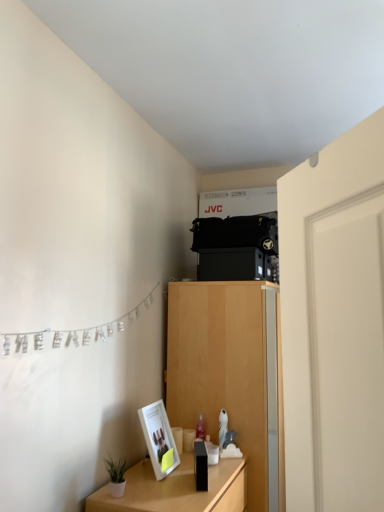
Locate an element on the screen. This screenshot has height=512, width=384. wooden table at lower left is located at coordinates (176, 489).

Where is `white smooth door at right`? white smooth door at right is located at coordinates (334, 323).

Would you say wooden table at lower left is inside or outside light wood cabinet at center?

wooden table at lower left is not inside light wood cabinet at center, it's outside.

Considering the relative sizes of wooden table at lower left and light wood cabinet at center in the image provided, is wooden table at lower left smaller than light wood cabinet at center?

Yes, wooden table at lower left is smaller than light wood cabinet at center.

Where is `cabinetry located on the right of wooden table at lower left`? cabinetry located on the right of wooden table at lower left is located at coordinates 231,373.

Is wooden table at lower left turned away from white smooth door at right?

No, wooden table at lower left is not facing the opposite direction of white smooth door at right.

Which object is closer to the camera, wooden table at lower left or white smooth door at right?

Positioned in front is white smooth door at right.

From the picture: Between wooden table at lower left and white smooth door at right, which one has larger size?

wooden table at lower left is bigger.

Is wooden table at lower left completely or partially outside of white smooth door at right?

Yes.

Is silver metallic banner at left not inside light wood cabinet at center?

Absolutely, silver metallic banner at left is external to light wood cabinet at center.

Which is closer to the camera, (90, 333) or (274, 464)?

Clearly, point (90, 333) is closer to the camera than point (274, 464).

The height and width of the screenshot is (512, 384). I want to click on cabinetry located on the right of silver metallic banner at left, so click(x=231, y=373).

Between light wood cabinet at center and matte white picture frame at lower left, which one is positioned behind?

light wood cabinet at center.

Is light wood cabinet at center facing towards matte white picture frame at lower left?

No, light wood cabinet at center is not turned towards matte white picture frame at lower left.

Considering the sizes of light wood cabinet at center and matte white picture frame at lower left in the image, is light wood cabinet at center bigger or smaller than matte white picture frame at lower left?

In the image, light wood cabinet at center appears to be larger than matte white picture frame at lower left.

Would you consider light wood cabinet at center to be distant from matte white picture frame at lower left?

They are positioned close to each other.

Does light wood cabinet at center turn towards wooden table at lower left?

No, light wood cabinet at center is not facing towards wooden table at lower left.

Locate an element on the screen. table in front of the light wood cabinet at center is located at coordinates click(x=176, y=489).

Is light wood cabinet at center smaller than wooden table at lower left?

Actually, light wood cabinet at center might be larger than wooden table at lower left.

Is point (177, 399) farther from viewer compared to point (181, 494)?

Yes, point (177, 399) is farther from viewer.

Is white smooth door at right outside of matte white picture frame at lower left?

white smooth door at right is positioned outside matte white picture frame at lower left.

Which object is positioned more to the left, white smooth door at right or matte white picture frame at lower left?

matte white picture frame at lower left is more to the left.

Can you confirm if white smooth door at right is wider than matte white picture frame at lower left?

Yes, white smooth door at right is wider than matte white picture frame at lower left.

Would you consider white smooth door at right to be distant from matte white picture frame at lower left?

That's right, there is a large distance between white smooth door at right and matte white picture frame at lower left.

Considering the sizes of light wood cabinet at center and white smooth door at right in the image, is light wood cabinet at center bigger or smaller than white smooth door at right?

Clearly, light wood cabinet at center is larger in size than white smooth door at right.

Looking at their sizes, would you say light wood cabinet at center is wider or thinner than white smooth door at right?

In the image, light wood cabinet at center appears to be wider than white smooth door at right.

Can you tell me how much light wood cabinet at center and white smooth door at right differ in facing direction?

30.4 degrees.

Identify the location of cabinetry on the right of the wooden table at lower left. (231, 373).

At what (x,y) coordinates should I click in order to perform the action: click on table directly beneath the white smooth door at right (from a real-world perspective). Please return your answer as a coordinate pair (x, y). Looking at the image, I should click on (176, 489).

Considering their positions, is wooden table at lower left positioned further to silver metallic banner at left than light wood cabinet at center?

wooden table at lower left lies further to silver metallic banner at left than the other object.

Based on their spatial positions, is silver metallic banner at left or light wood cabinet at center further from matte white picture frame at lower left?

silver metallic banner at left is positioned further to the anchor matte white picture frame at lower left.

Estimate the real-world distances between objects in this image. Which object is closer to silver metallic banner at left, white smooth door at right or wooden table at lower left?

The object closer to silver metallic banner at left is wooden table at lower left.

Looking at the image, which one is located further to silver metallic banner at left, matte white picture frame at lower left or wooden table at lower left?

wooden table at lower left.

Looking at the image, which one is located closer to white smooth door at right, light wood cabinet at center or matte white picture frame at lower left?

Based on the image, matte white picture frame at lower left appears to be nearer to white smooth door at right.

When comparing their distances from silver metallic banner at left, does matte white picture frame at lower left or white smooth door at right seem closer?

matte white picture frame at lower left.

Consider the image. Based on their spatial positions, is matte white picture frame at lower left or silver metallic banner at left closer to white smooth door at right?

silver metallic banner at left is closer to white smooth door at right.

When comparing their distances from wooden table at lower left, does light wood cabinet at center or silver metallic banner at left seem closer?

light wood cabinet at center lies closer to wooden table at lower left than the other object.

You are a GUI agent. You are given a task and a screenshot of the screen. Output one action in this format:
    pyautogui.click(x=<x>, y=<y>)
    Task: Click on the table between white smooth door at right and matte white picture frame at lower left from front to back
    The height and width of the screenshot is (512, 384).
    Given the screenshot: What is the action you would take?
    pyautogui.click(x=176, y=489)

I want to click on picture frame between wooden table at lower left and light wood cabinet at center from front to back, so click(x=158, y=438).

The width and height of the screenshot is (384, 512). Identify the location of clothesline positioned between white smooth door at right and light wood cabinet at center from near to far. (69, 333).

Where is `table between white smooth door at right and light wood cabinet at center in the front-back direction`? table between white smooth door at right and light wood cabinet at center in the front-back direction is located at coordinates (176, 489).